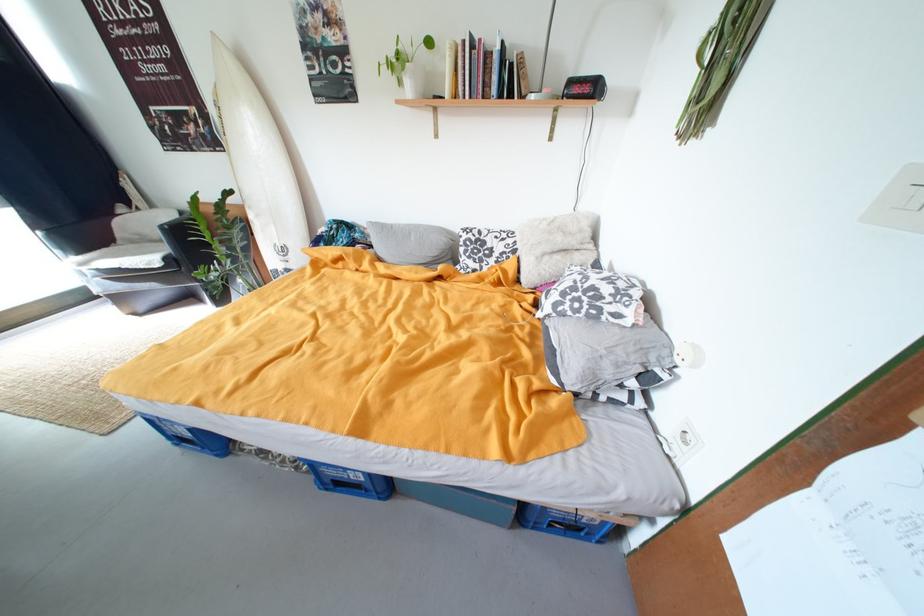
In order to click on patterned pillow in this screenshot , I will do `click(593, 297)`.